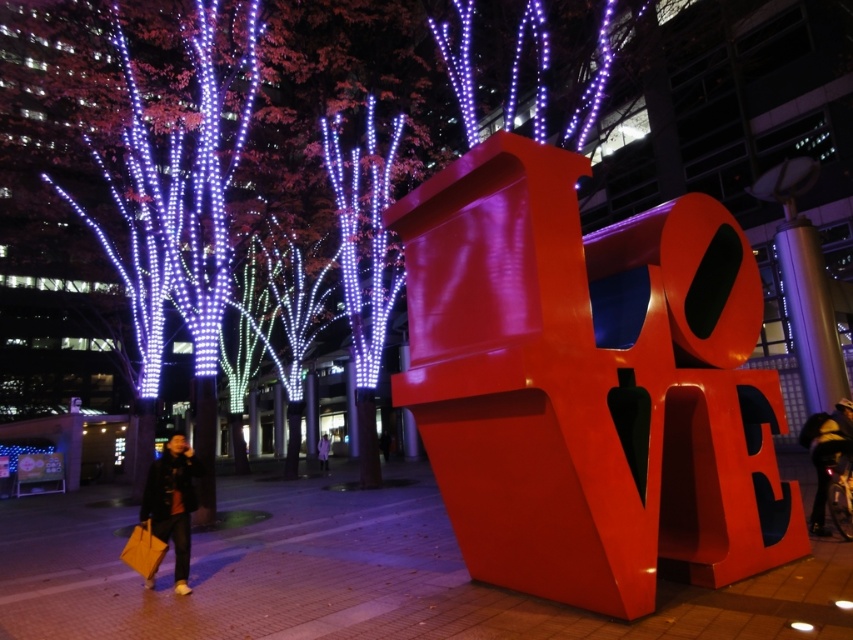
You are standing in front of the LOVE sculpture and notice two leather jackets. Which direction should you walk to reach the dark brown leather jacket at lower left from the dark blue leather jacket at lower right?

You should walk to the left to reach the dark brown leather jacket at lower left from the dark blue leather jacket at lower right because it is positioned to the left of the latter.

You are standing in the urban nighttime scene and want to pick up both the dark brown leather jacket at lower left and the purple fabric coat at lower left. Which one is closer to you?

The dark brown leather jacket at lower left is 14.89 meters away from the purple fabric coat at lower left, so the purple fabric coat at lower left is closer to you.

You are a photographer setting up a tripod to capture the illuminated LOVE sculpture. You notice two jackets hanging on a rack nearby. The dark brown leather jacket at lower left and the dark blue leather jacket at lower right. Which jacket is closer to the sculpture?

The dark brown leather jacket at lower left is closer to the sculpture because it is in front of the dark blue leather jacket at lower right.